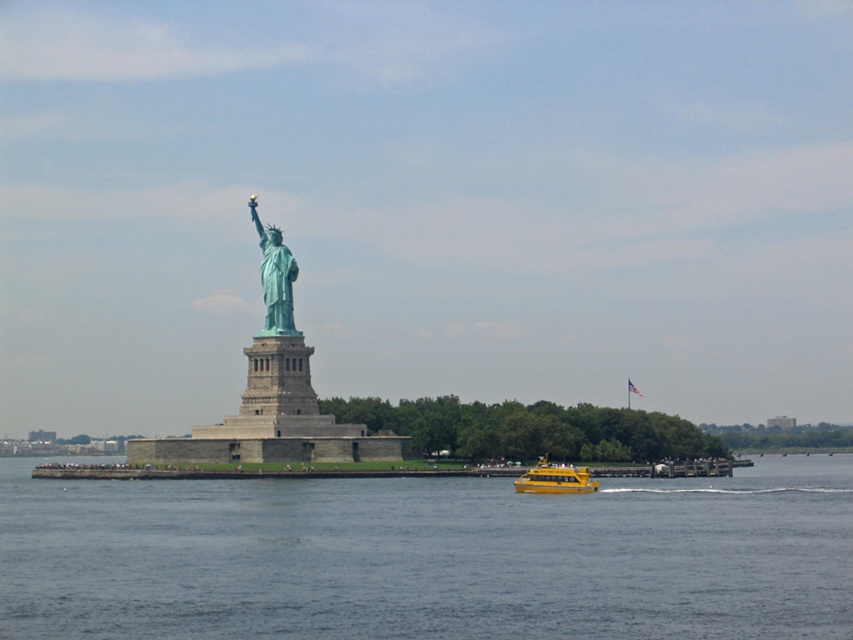
Does blue water at center lie in front of green patina statue at center?

A: Yes.

Does blue water at center appear over green patina statue at center?

Actually, blue water at center is below green patina statue at center.

This screenshot has width=853, height=640. Identify the location of blue water at center. (428, 556).

Does green patina statue at center have a larger size compared to yellow plastic boat at lower center?

Yes.

Does point (287, 257) lie in front of point (589, 484)?

No, (287, 257) is further to viewer.

I want to click on green patina statue at center, so coord(276,278).

In order to click on green patina statue at center in this screenshot , I will do `click(276, 278)`.

Based on the photo, does blue water at center appear on the left side of yellow plastic boat at lower center?

Correct, you'll find blue water at center to the left of yellow plastic boat at lower center.

Does blue water at center have a greater width compared to yellow plastic boat at lower center?

Indeed, blue water at center has a greater width compared to yellow plastic boat at lower center.

Measure the distance between point (846, 560) and camera.

They are 115.27 meters apart.

The image size is (853, 640). Identify the location of blue water at center. point(428,556).